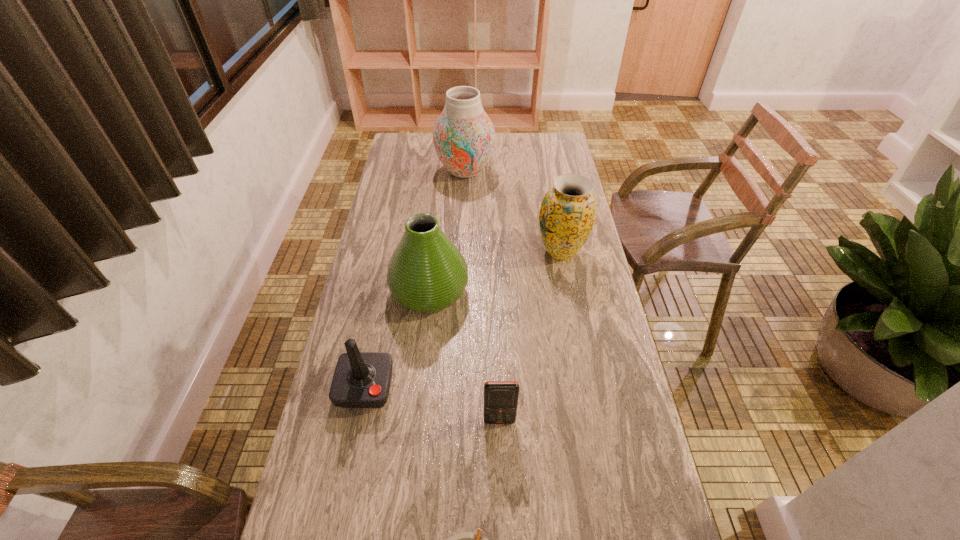
Where is `object that stands as the closest to the ashtray`? This screenshot has height=540, width=960. object that stands as the closest to the ashtray is located at coordinates (500, 397).

Locate which object ranks third in proximity to the shortest object. Please provide its 2D coordinates. Your answer should be formatted as a tuple, i.e. [(x, y)], where the tuple contains the x and y coordinates of a point satisfying the conditions above.

[(427, 273)]

Locate an element on the screen. The height and width of the screenshot is (540, 960). vase that stands as the closest to the cellular telephone is located at coordinates (427, 273).

Find the location of `the third closest vase relative to the second nearest object`. the third closest vase relative to the second nearest object is located at coordinates (464, 137).